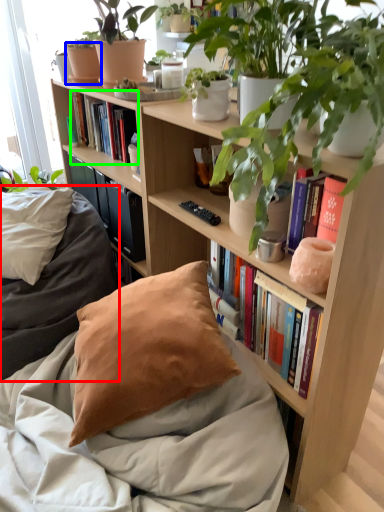
Question: Which object is positioned farthest from bedding (highlighted by a red box)? Select from flowerpot (highlighted by a blue box) and book (highlighted by a green box).

Choices:
 (A) flowerpot
 (B) book

Answer: (A)